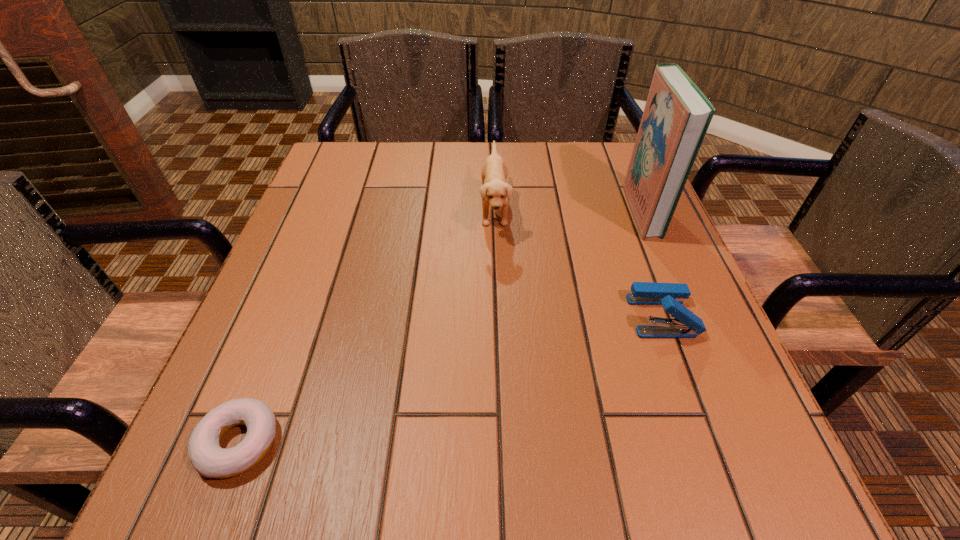
You are a GUI agent. You are given a task and a screenshot of the screen. Output one action in this format:
    pyautogui.click(x=<x>, y=<y>)
    Task: Click on the stapler located in the right edge section of the desktop
    Image resolution: width=960 pixels, height=540 pixels.
    Given the screenshot: What is the action you would take?
    pyautogui.click(x=686, y=324)

At what (x,y) coordinates should I click in order to perform the action: click on object situated at the near left corner. Please return your answer as a coordinate pair (x, y). Looking at the image, I should click on (207, 457).

This screenshot has width=960, height=540. Identify the location of object located at the far right corner. (676, 117).

Find the location of a particular element. This screenshot has height=540, width=960. vacant space at the far edge is located at coordinates (396, 159).

The width and height of the screenshot is (960, 540). Find the location of `vacant area at the near edge`. vacant area at the near edge is located at coordinates (564, 503).

Locate an element on the screen. blank space at the left edge of the desktop is located at coordinates (291, 299).

The height and width of the screenshot is (540, 960). Find the location of `free spot at the right edge of the desktop`. free spot at the right edge of the desktop is located at coordinates (654, 262).

In the image, there is a desktop. Find the location of `vacant space at the far left corner`. vacant space at the far left corner is located at coordinates (367, 144).

Identify the location of vacant space at the near left corner of the desktop. The height and width of the screenshot is (540, 960). [204, 504].

In the image, there is a desktop. Where is `vacant space at the far right corner`? The width and height of the screenshot is (960, 540). vacant space at the far right corner is located at coordinates (587, 165).